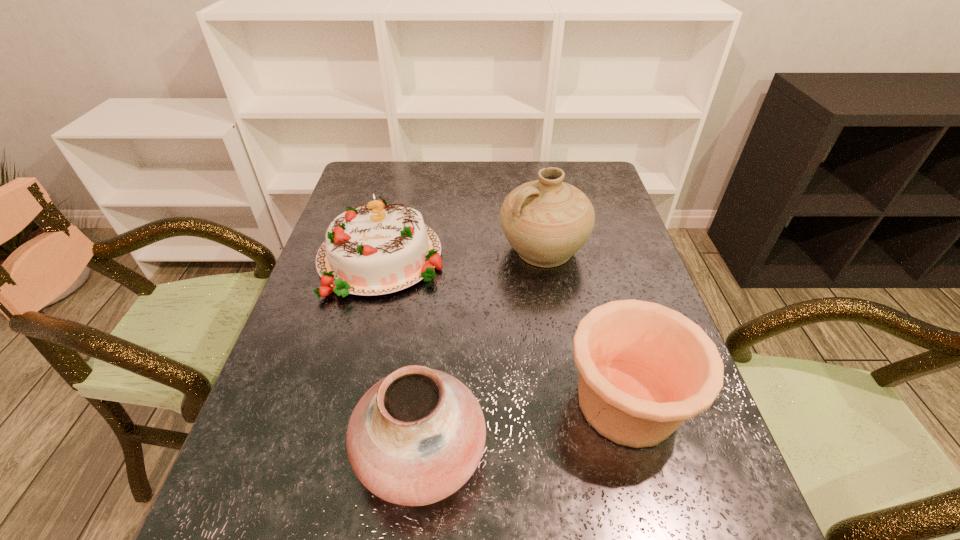
In order to click on pottery that is the closest one to the cake in this screenshot , I will do `click(546, 221)`.

Locate an element on the screen. This screenshot has height=540, width=960. vacant area that satisfies the following two spatial constraints: 1. on the back side of the leftmost pottery; 2. on the right side of the tallest object is located at coordinates (441, 249).